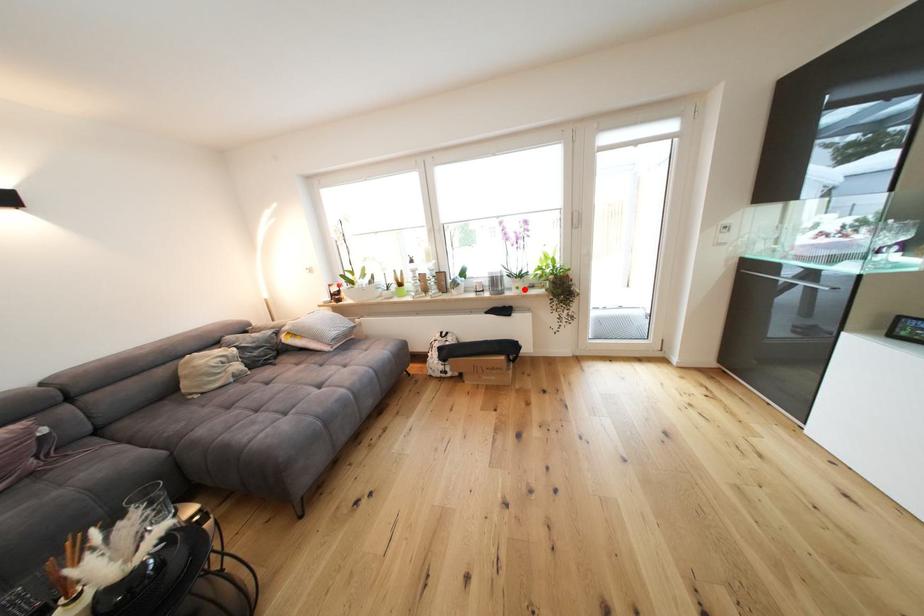
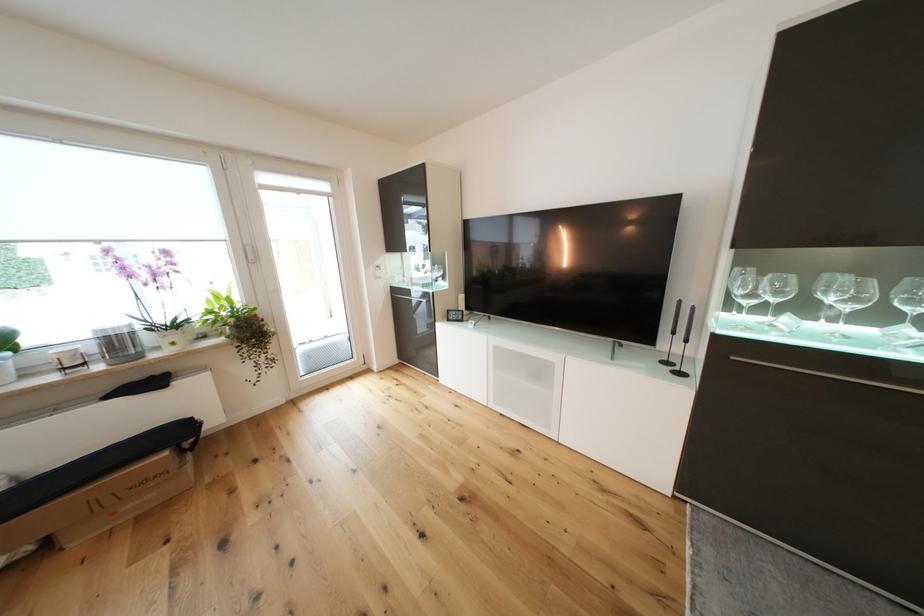
Where in the second image is the point corresponding to the highlighted location from the first image?

(180, 345)